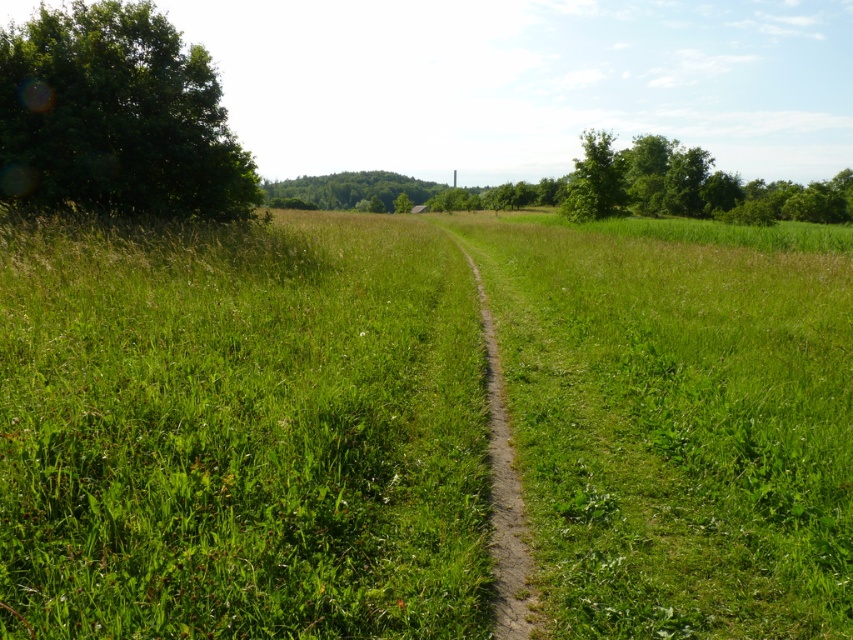
Can you confirm if green grassy pasture at center is smaller than dirt path at center?

Incorrect, green grassy pasture at center is not smaller in size than dirt path at center.

Does green grassy pasture at center have a lesser width compared to dirt path at center?

In fact, green grassy pasture at center might be wider than dirt path at center.

Which is in front, point (514, 257) or point (495, 451)?

Point (495, 451)

Find the location of a particular element. The width and height of the screenshot is (853, 640). green grassy pasture at center is located at coordinates (241, 429).

In order to click on dirt path at center in this screenshot , I will do `click(503, 497)`.

Is dirt path at center positioned at the back of green leafy tree at upper right?

No, dirt path at center is closer to the viewer.

Where is `dirt path at center`? dirt path at center is located at coordinates (503, 497).

This screenshot has height=640, width=853. Find the location of `dirt path at center`. dirt path at center is located at coordinates (503, 497).

Image resolution: width=853 pixels, height=640 pixels. What do you see at coordinates (241, 429) in the screenshot?
I see `green grassy pasture at center` at bounding box center [241, 429].

Is green grassy pasture at center wider than green leafy tree at upper right?

No, green grassy pasture at center is not wider than green leafy tree at upper right.

Image resolution: width=853 pixels, height=640 pixels. I want to click on green grassy pasture at center, so [x=241, y=429].

Locate an element on the screen. Image resolution: width=853 pixels, height=640 pixels. green grassy pasture at center is located at coordinates (241, 429).